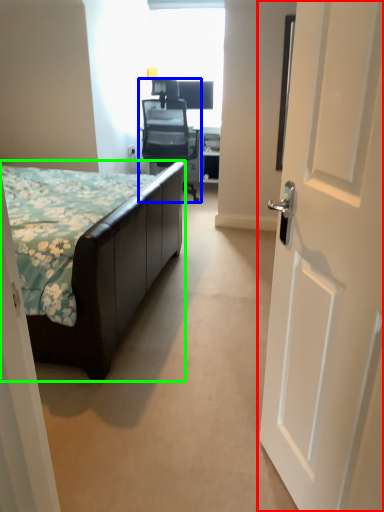
Question: Estimate the real-world distances between objects in this image. Which object is farther from door (highlighted by a red box), chair (highlighted by a blue box) or bed (highlighted by a green box)?

Choices:
 (A) chair
 (B) bed

Answer: (A)